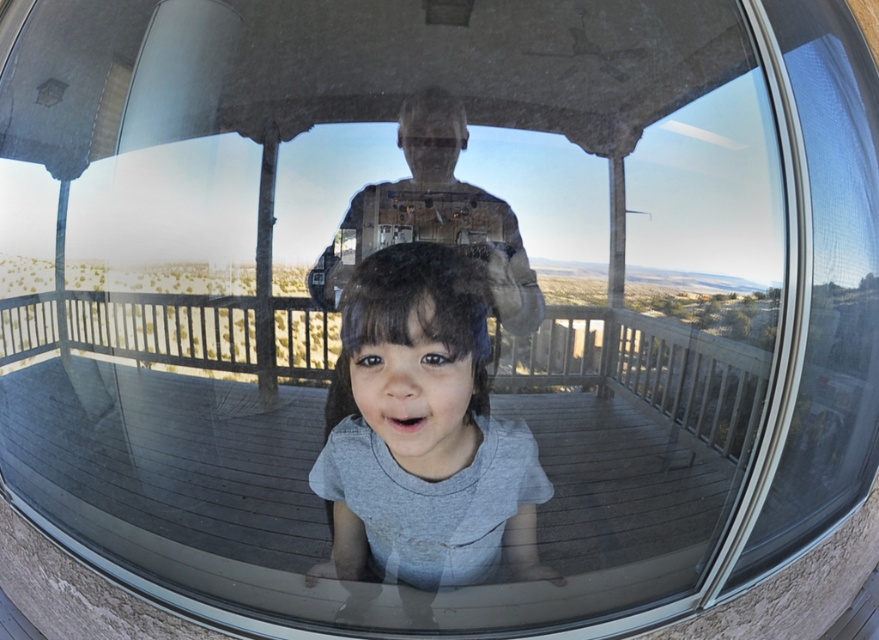
Question: Is gray matte shirt at center positioned before matte gray shirt at center?

Choices:
 (A) no
 (B) yes

Answer: (B)

Question: In this image, where is gray matte shirt at center located relative to matte gray shirt at center?

Choices:
 (A) right
 (B) left

Answer: (B)

Question: Can you confirm if gray matte shirt at center is positioned to the right of matte gray shirt at center?

Choices:
 (A) no
 (B) yes

Answer: (A)